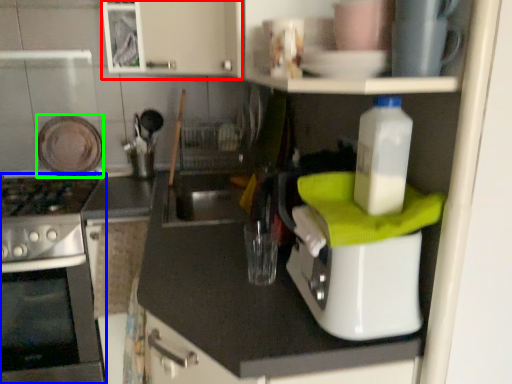
Question: Which object is positioned closest to cabinetry (highlighted by a red box)? Select from home appliance (highlighted by a blue box) and appliance (highlighted by a green box).

Choices:
 (A) home appliance
 (B) appliance

Answer: (B)